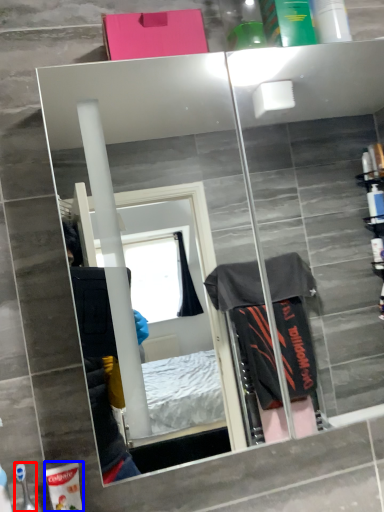
Question: Which of the following is the closest to the observer, toiletry (highlighted by a red box) or toiletry (highlighted by a blue box)?

Choices:
 (A) toiletry
 (B) toiletry

Answer: (A)